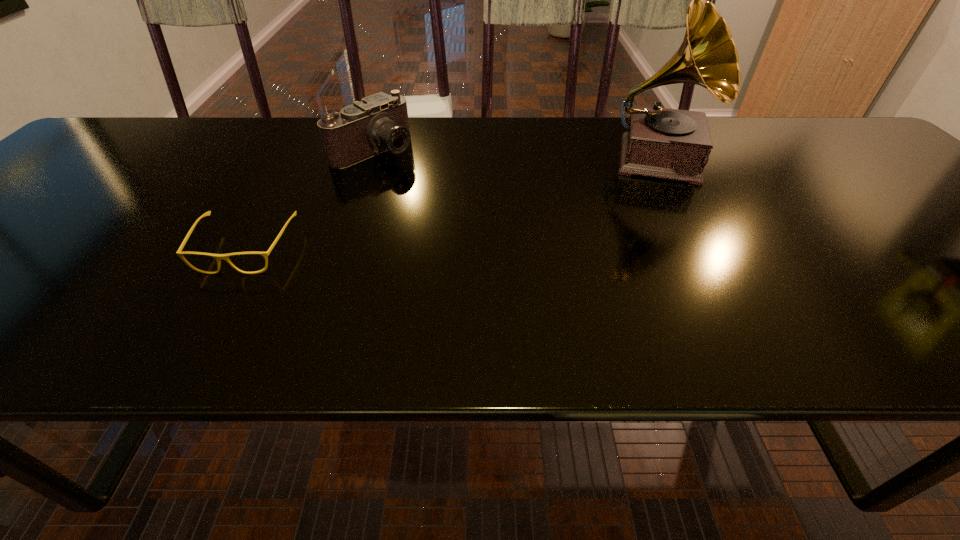
Locate an element on the screen. This screenshot has width=960, height=540. vacant space at the far right corner of the desktop is located at coordinates (798, 127).

Find the location of a particular element. This screenshot has width=960, height=540. free space that is in between the phonograph record and the spectacles is located at coordinates (452, 204).

You are a GUI agent. You are given a task and a screenshot of the screen. Output one action in this format:
    pyautogui.click(x=<x>, y=<y>)
    Task: Click on the unoccupied position between the spectacles and the rightmost object
    This screenshot has height=540, width=960.
    Given the screenshot: What is the action you would take?
    pyautogui.click(x=452, y=204)

Where is `vacant space in between the tallest object and the shortest object`? This screenshot has width=960, height=540. vacant space in between the tallest object and the shortest object is located at coordinates (452, 204).

Find the location of a particular element. empty space between the tallest object and the second shortest object is located at coordinates (516, 154).

Where is `empty space that is in between the spectacles and the second shortest object`? Image resolution: width=960 pixels, height=540 pixels. empty space that is in between the spectacles and the second shortest object is located at coordinates (310, 199).

Find the location of `vacant area between the phonograph record and the spectacles`. vacant area between the phonograph record and the spectacles is located at coordinates (452, 204).

Where is `the second closest object to the camera`? the second closest object to the camera is located at coordinates (674, 144).

Image resolution: width=960 pixels, height=540 pixels. What are the coordinates of `the second closest object to the shortest object` in the screenshot? It's located at (674, 144).